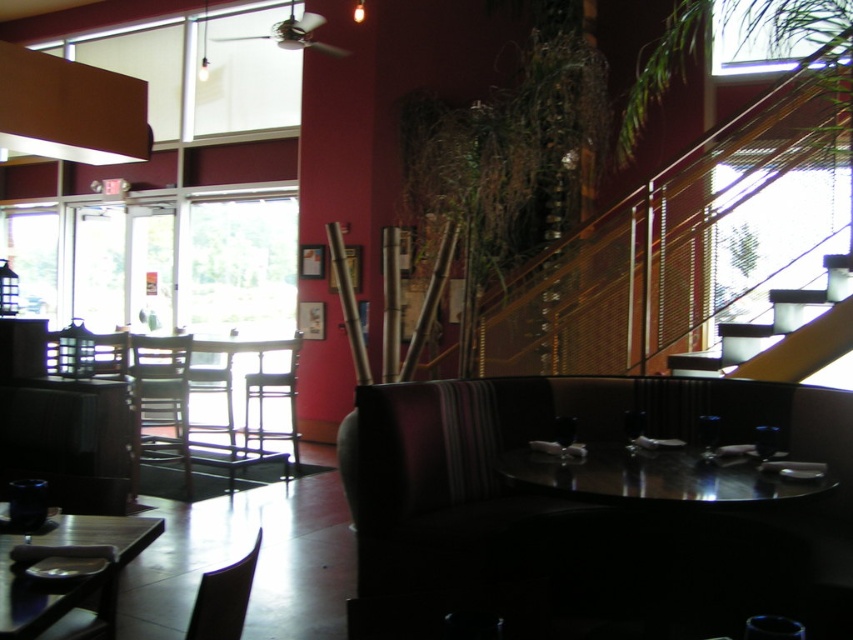
Question: Does glossy black table at center have a greater width compared to wooden chair at center?

Choices:
 (A) no
 (B) yes

Answer: (B)

Question: Which of the following is the farthest from the observer?

Choices:
 (A) wooden chair at center
 (B) matte black chair at lower left
 (C) wooden chair at left
 (D) brown wooden chair at left

Answer: (A)

Question: Which point is closer to the camera?

Choices:
 (A) (289, 440)
 (B) (90, 584)

Answer: (B)

Question: Is glossy black table at center to the left of wooden chair at center from the viewer's perspective?

Choices:
 (A) yes
 (B) no

Answer: (B)

Question: In this image, where is brown wooden chair at left located relative to matte black chair at lower left?

Choices:
 (A) left
 (B) right

Answer: (A)

Question: Which of the following is the closest to the observer?

Choices:
 (A) (782, 467)
 (B) (83, 353)
 (C) (32, 611)

Answer: (C)